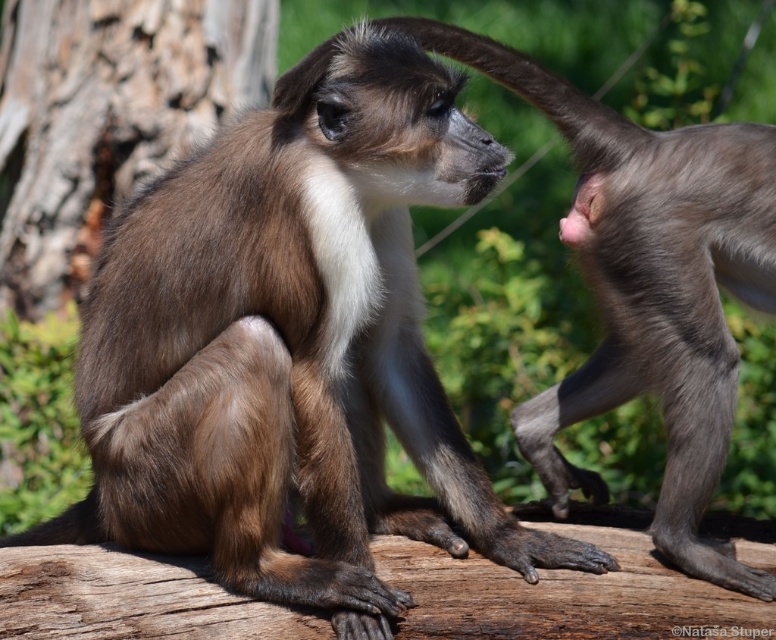
Does brown fur monkey at upper right appear over brown rough bark at left?

Incorrect, brown fur monkey at upper right is not positioned above brown rough bark at left.

Measure the distance between point (560, 509) and camera.

Point (560, 509) is 9.73 feet from camera.

Which is behind, point (574, 227) or point (258, 48)?

Positioned behind is point (258, 48).

The height and width of the screenshot is (640, 776). In order to click on brown fur monkey at upper right in this screenshot , I will do `click(648, 289)`.